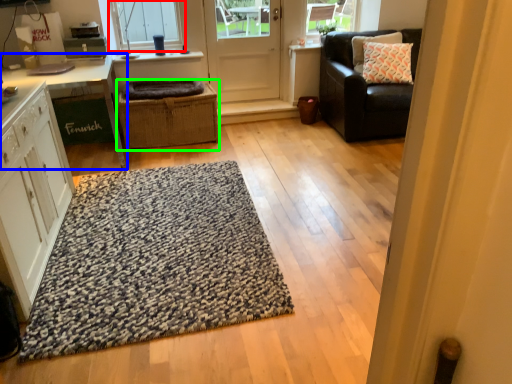
Question: Based on their relative distances, which object is farther from window (highlighted by a red box)? Choose from table (highlighted by a blue box) and crate (highlighted by a green box).

Choices:
 (A) table
 (B) crate

Answer: (B)